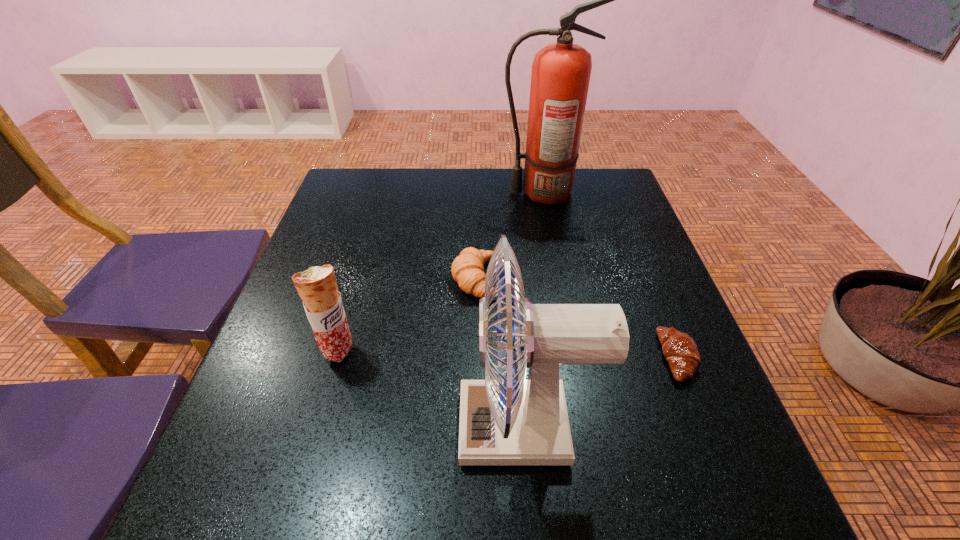
Locate an element on the screen. free space that is in between the second tallest object and the third shortest object is located at coordinates (432, 389).

The width and height of the screenshot is (960, 540). Find the location of `free area in between the rightmost object and the farthest object`. free area in between the rightmost object and the farthest object is located at coordinates (610, 275).

Locate an element on the screen. The width and height of the screenshot is (960, 540). vacant space that is in between the nearer crescent roll and the fire extinguisher is located at coordinates (610, 275).

This screenshot has width=960, height=540. I want to click on vacant area that lies between the burrito and the left crescent roll, so click(408, 315).

You are a GUI agent. You are given a task and a screenshot of the screen. Output one action in this format:
    pyautogui.click(x=<x>, y=<y>)
    Task: Click on the free space between the fire extinguisher and the farther crescent roll
    
    Given the screenshot: What is the action you would take?
    pyautogui.click(x=509, y=235)

Identify the location of free point between the fourth nearest object and the third shortest object. (408, 315).

Identify the location of free space between the fan and the burrito. The image size is (960, 540). (432, 389).

Identify which object is located as the second nearest to the second farthest object. Please provide its 2D coordinates. Your answer should be formatted as a tuple, i.e. [(x, y)], where the tuple contains the x and y coordinates of a point satisfying the conditions above.

[(317, 287)]

The image size is (960, 540). In order to click on object that can be found as the second closest to the second tallest object in this screenshot , I will do `click(679, 349)`.

What are the coordinates of `vacant space that satisfies the following two spatial constraints: 1. on the back side of the shorter crescent roll; 2. on the nozzle of the fire extinguisher` in the screenshot? It's located at (612, 192).